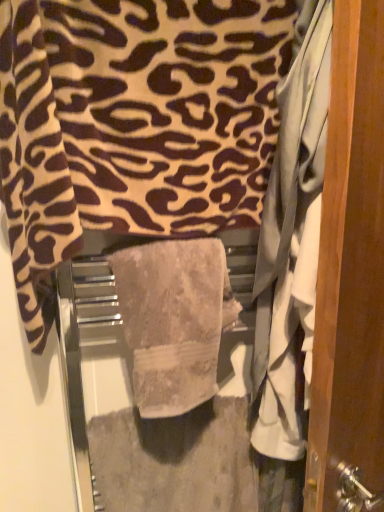
Question: Is beige textured towel at center, acting as the 2th towel starting from the top, positioned with its back to wooden door at right?

Choices:
 (A) yes
 (B) no

Answer: (B)

Question: Can you confirm if beige textured towel at center, which is counted as the first towel, starting from the bottom, is thinner than wooden door at right?

Choices:
 (A) yes
 (B) no

Answer: (B)

Question: Is the surface of beige textured towel at center, which is counted as the first towel, starting from the bottom, in direct contact with wooden door at right?

Choices:
 (A) yes
 (B) no

Answer: (B)

Question: Does beige textured towel at center, acting as the 2th towel starting from the top, turn towards wooden door at right?

Choices:
 (A) yes
 (B) no

Answer: (B)

Question: From a real-world perspective, is beige textured towel at center, acting as the 2th towel starting from the top, located higher than wooden door at right?

Choices:
 (A) no
 (B) yes

Answer: (A)

Question: Is beige textured towel at center, which is counted as the first towel, starting from the bottom, closer to camera compared to wooden door at right?

Choices:
 (A) yes
 (B) no

Answer: (B)

Question: Is beige textured towel at center, which is counted as the first towel, starting from the bottom, further to camera compared to beige textured towel at center, which appears as the second towel when ordered from the bottom?

Choices:
 (A) yes
 (B) no

Answer: (A)

Question: Is beige textured towel at center, which is counted as the first towel, starting from the bottom, at the left side of beige textured towel at center, which appears as the second towel when ordered from the bottom?

Choices:
 (A) no
 (B) yes

Answer: (A)

Question: From the image's perspective, is beige textured towel at center, acting as the 2th towel starting from the top, below beige textured towel at center, arranged as the 1th towel when viewed from the top?

Choices:
 (A) no
 (B) yes

Answer: (B)

Question: Is beige textured towel at center, acting as the 2th towel starting from the top, touching beige textured towel at center, which appears as the second towel when ordered from the bottom?

Choices:
 (A) yes
 (B) no

Answer: (B)

Question: Considering the relative sizes of beige textured towel at center, acting as the 2th towel starting from the top, and beige textured towel at center, arranged as the 1th towel when viewed from the top, in the image provided, is beige textured towel at center, acting as the 2th towel starting from the top, bigger than beige textured towel at center, arranged as the 1th towel when viewed from the top,?

Choices:
 (A) no
 (B) yes

Answer: (A)

Question: From the image's perspective, would you say beige textured towel at center, acting as the 2th towel starting from the top, is positioned over beige textured towel at center, which appears as the second towel when ordered from the bottom?

Choices:
 (A) no
 (B) yes

Answer: (A)

Question: From a real-world perspective, does beige textured towel at center, which appears as the second towel when ordered from the bottom, stand above beige textured towel at center, acting as the 2th towel starting from the top?

Choices:
 (A) yes
 (B) no

Answer: (A)